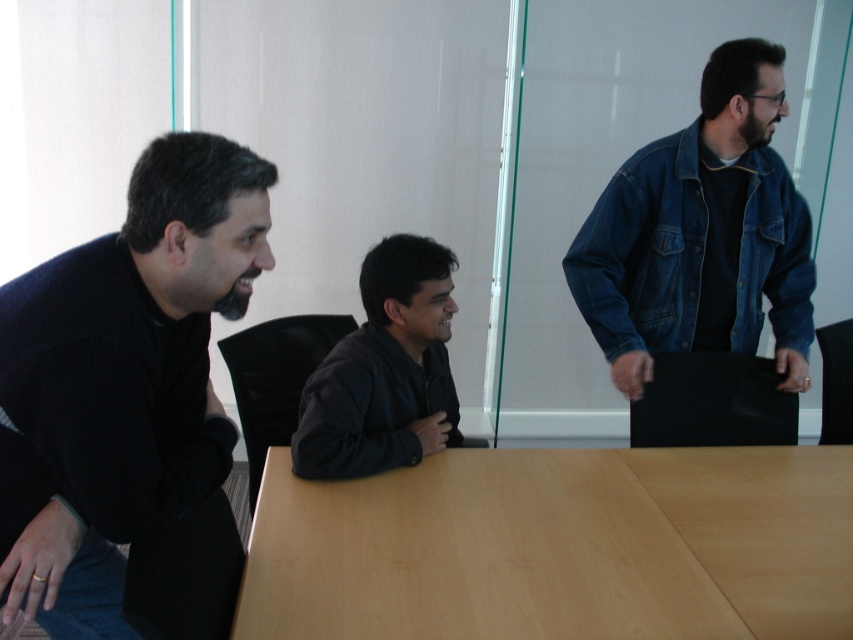
Question: Which is nearer to the light brown wood table at center?

Choices:
 (A) denim jacket at right
 (B) dark blue sweater at left
 (C) black leather jacket at center

Answer: (C)

Question: Considering the relative positions of dark blue sweater at left and denim jacket at right in the image provided, where is dark blue sweater at left located with respect to denim jacket at right?

Choices:
 (A) below
 (B) above

Answer: (A)

Question: Which object is closer to the camera taking this photo?

Choices:
 (A) dark blue sweater at left
 (B) black leather jacket at center
 (C) light brown wood table at center
 (D) denim jacket at right

Answer: (A)

Question: Is dark blue sweater at left below black leather jacket at center?

Choices:
 (A) no
 (B) yes

Answer: (B)

Question: Can you confirm if light brown wood table at center is thinner than dark blue sweater at left?

Choices:
 (A) yes
 (B) no

Answer: (B)

Question: Which point appears farthest from the camera in this image?

Choices:
 (A) (294, 436)
 (B) (717, 276)
 (C) (19, 296)

Answer: (B)